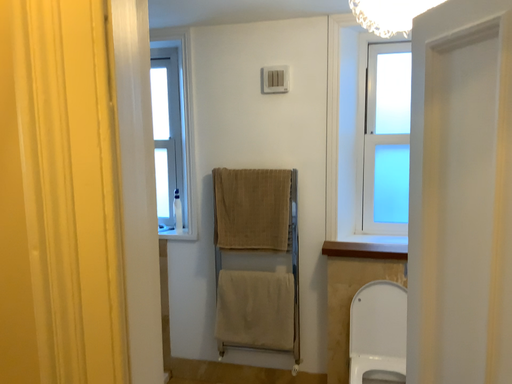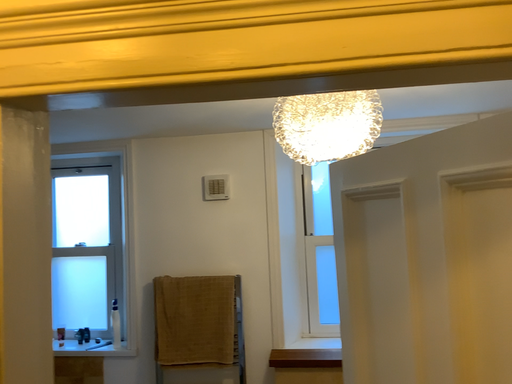
Question: How did the camera likely rotate when shooting the video?

Choices:
 (A) rotated downward
 (B) rotated upward

Answer: (B)